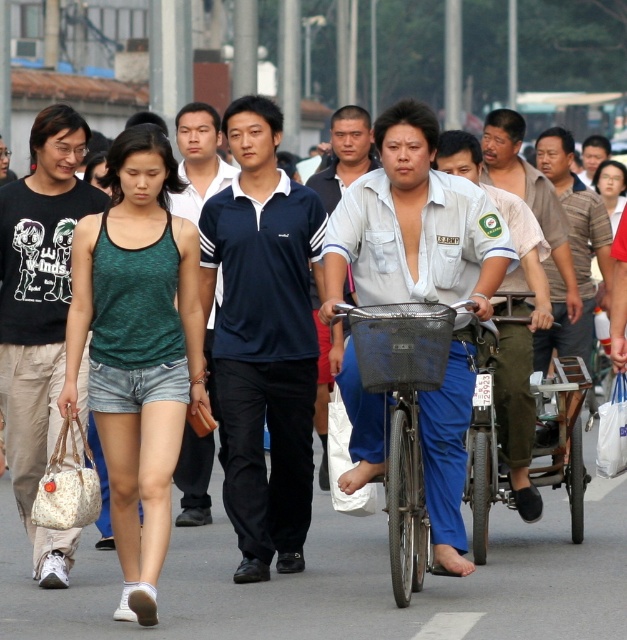
Question: Is the position of metallic silver bicycle at center less distant than that of dark blue jersey at center?

Choices:
 (A) no
 (B) yes

Answer: (B)

Question: Which point is closer to the camera?

Choices:
 (A) (233, 289)
 (B) (18, 186)
 (C) (393, 403)

Answer: (C)

Question: Is metallic silver cart at lower right in front of striped cotton shirt at center?

Choices:
 (A) no
 (B) yes

Answer: (B)

Question: Can you confirm if navy blue jersey at center is smaller than black cotton t-shirt at left?

Choices:
 (A) no
 (B) yes

Answer: (A)

Question: Which object appears farthest from the camera in this image?

Choices:
 (A) light brown uniform at center
 (B) light blue denim pants at center

Answer: (A)

Question: Which object appears farthest from the camera in this image?

Choices:
 (A) metallic silver bicycle at center
 (B) light brown uniform at center
 (C) black cotton t-shirt at left

Answer: (B)